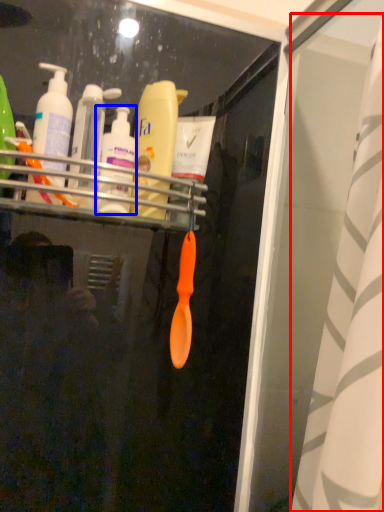
Question: Which of the following is the farthest to the observer, shower curtain (highlighted by a red box) or toiletry (highlighted by a blue box)?

Choices:
 (A) shower curtain
 (B) toiletry

Answer: (B)